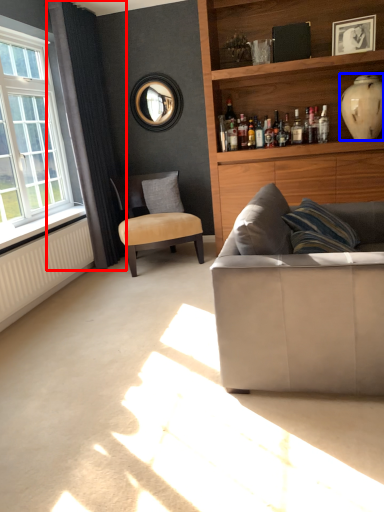
Question: Which of the following is the farthest to the observer, curtain (highlighted by a red box) or vase (highlighted by a blue box)?

Choices:
 (A) curtain
 (B) vase

Answer: (A)